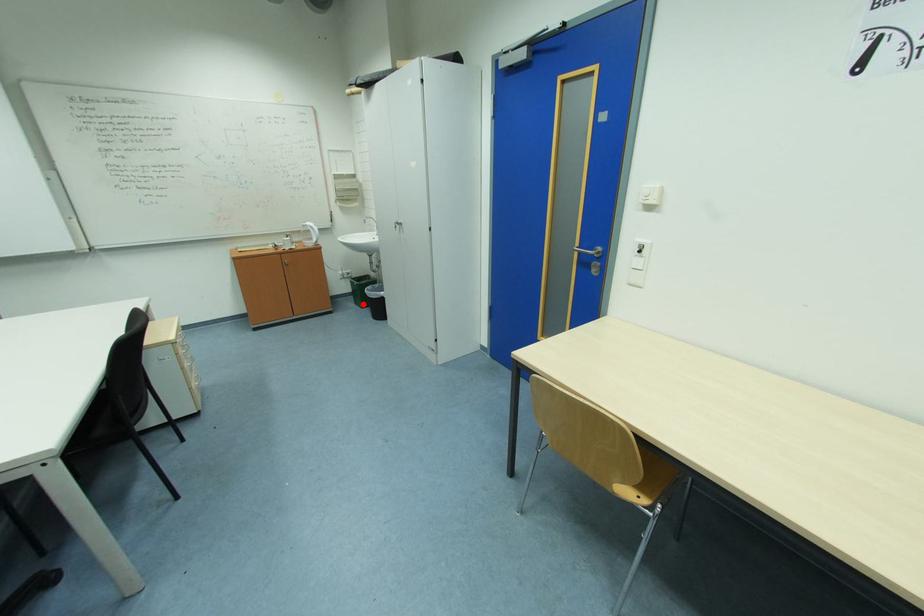
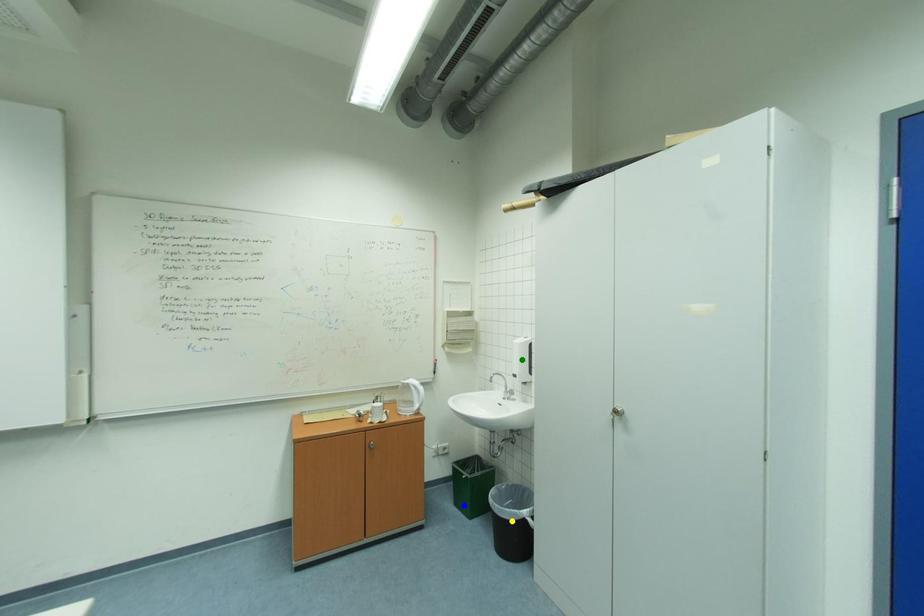
Question: I am providing you with two images of the same scene from different viewpoints. A red point is marked on the first image. You are given multiple points on the second image. Which mark in image 2 goes with the point in image 1?

Choices:
 (A) green point
 (B) yellow point
 (C) blue point

Answer: (C)